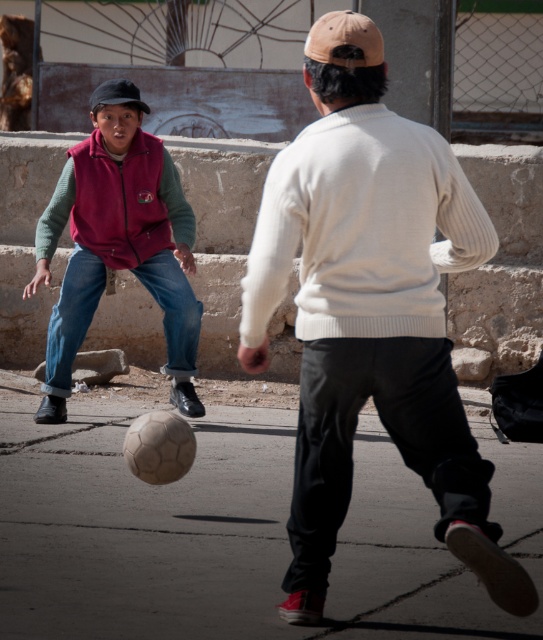
Does white knit sweater at center appear on the right side of matte pink vest at left?

Correct, you'll find white knit sweater at center to the right of matte pink vest at left.

Who is taller, white knit sweater at center or matte pink vest at left?

With more height is white knit sweater at center.

Is point (413, 456) closer to viewer compared to point (59, 218)?

Yes, it is.

Find the location of a particular element. white knit sweater at center is located at coordinates (370, 310).

Does white knit sweater at center have a greater width compared to matte red vest at left?

Incorrect, white knit sweater at center's width does not surpass matte red vest at left's.

Between white knit sweater at center and matte red vest at left, which one has less height?

matte red vest at left

Is point (286, 236) positioned in front of point (179, 180)?

Yes.

This screenshot has height=640, width=543. I want to click on white knit sweater at center, so click(x=370, y=310).

Between matte red vest at left and matte pink vest at left, which one has more height?

Standing taller between the two is matte red vest at left.

Is matte red vest at left taller than matte pink vest at left?

Indeed, matte red vest at left has a greater height compared to matte pink vest at left.

Who is more forward, (x=138, y=106) or (x=178, y=202)?

Point (x=138, y=106) is more forward.

This screenshot has height=640, width=543. Identify the location of matte red vest at left. (118, 243).